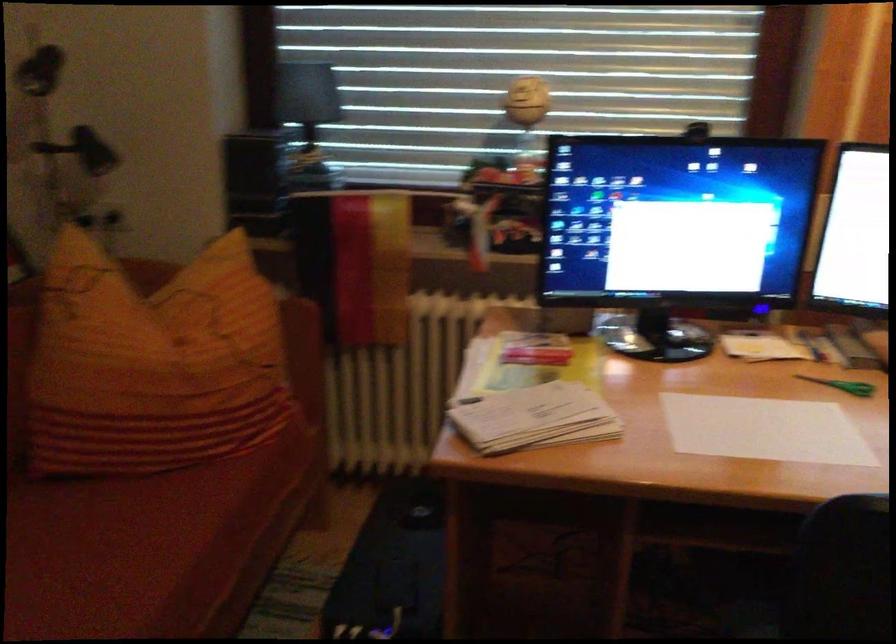
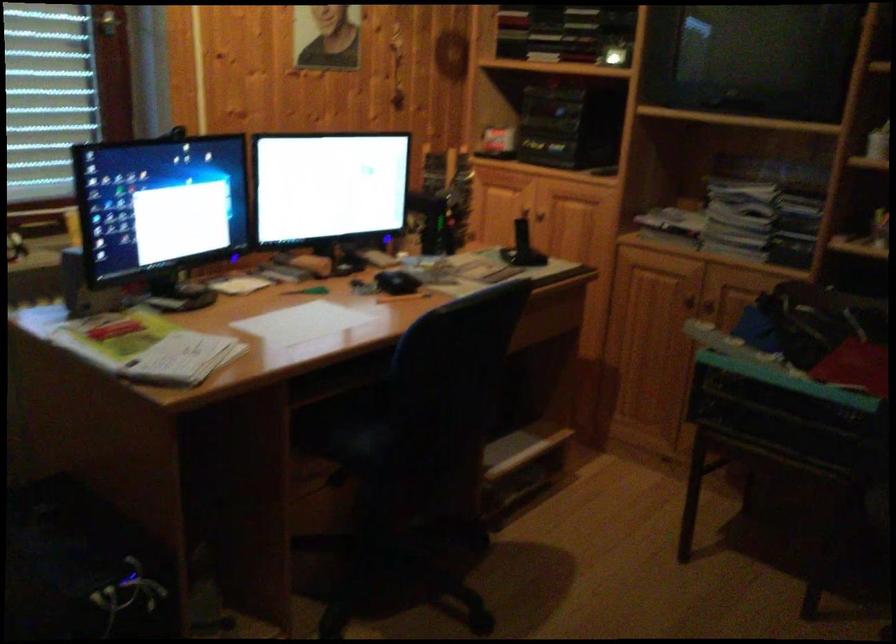
Question: The camera is either moving clockwise (left) or counter-clockwise (right) around the object. The first image is from the beginning of the video and the second image is from the end. Is the camera moving left or right when shooting the video?

Choices:
 (A) Left
 (B) Right

Answer: (A)